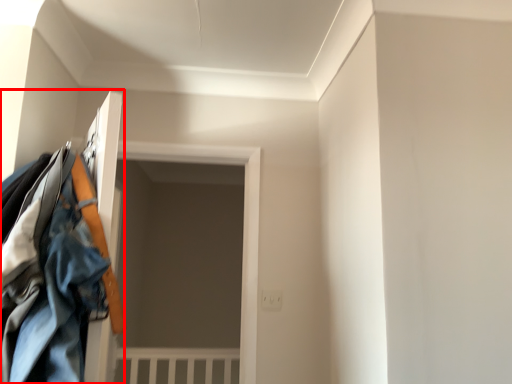
Question: Where is closet (annotated by the red box) located in relation to door in the image?

Choices:
 (A) right
 (B) left

Answer: (A)